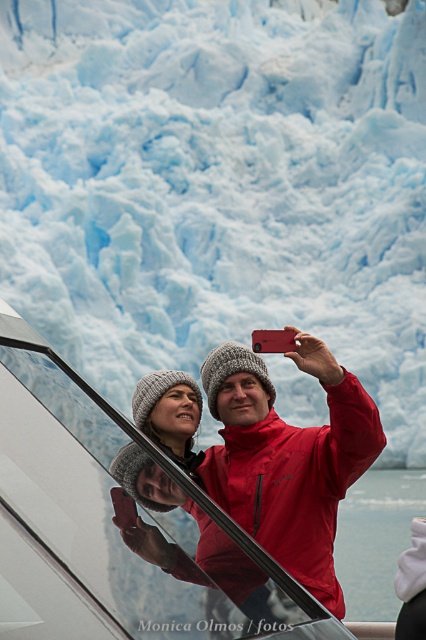
Question: Among these objects, which one is nearest to the camera?

Choices:
 (A) glacial ice at upper center
 (B) matte red jacket at center

Answer: (B)

Question: Does glacial ice at upper center lie behind matte red jacket at center?

Choices:
 (A) yes
 (B) no

Answer: (A)

Question: Can you confirm if glacial ice at upper center is positioned to the left of matte red jacket at center?

Choices:
 (A) yes
 (B) no

Answer: (A)

Question: Which object appears closest to the camera in this image?

Choices:
 (A) matte red jacket at center
 (B) glacial ice at upper center

Answer: (A)

Question: Does glacial ice at upper center have a lesser width compared to matte red jacket at center?

Choices:
 (A) no
 (B) yes

Answer: (A)